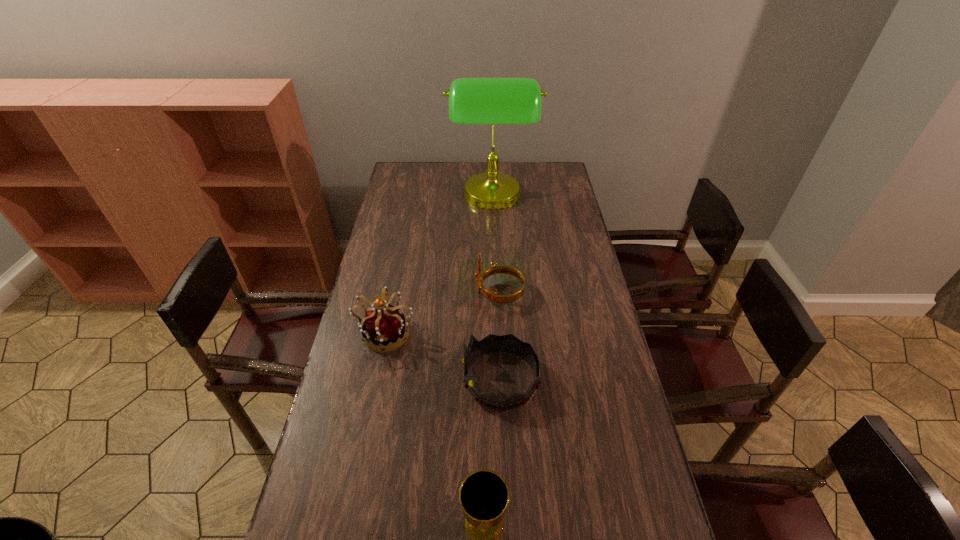
You are a GUI agent. You are given a task and a screenshot of the screen. Output one action in this format:
    pyautogui.click(x=<x>, y=<y>)
    Task: Click on the tallest object
    
    Given the screenshot: What is the action you would take?
    pyautogui.click(x=492, y=101)

Locate an element on the screen. Image resolution: width=960 pixels, height=540 pixels. the farthest object is located at coordinates (492, 101).

The width and height of the screenshot is (960, 540). I want to click on the fourth nearest object, so click(492, 296).

You are a GUI agent. You are given a task and a screenshot of the screen. Output one action in this format:
    pyautogui.click(x=<x>, y=<y>)
    Task: Click on the leftmost tiara
    
    Given the screenshot: What is the action you would take?
    pyautogui.click(x=384, y=326)

Find the location of a particular element. Image resolution: width=960 pixels, height=540 pixels. vacant position located on the desk next to the farthest object is located at coordinates (437, 198).

Locate an element on the screen. Image resolution: width=960 pixels, height=540 pixels. free space located 0.130m on the desk next to the farthest object is located at coordinates (x=422, y=198).

Locate an element on the screen. This screenshot has height=540, width=960. vacant region located on the desk next to the farthest object is located at coordinates (435, 198).

Image resolution: width=960 pixels, height=540 pixels. I want to click on vacant area situated on the front-facing side of the second farthest object, so click(x=459, y=293).

What are the coordinates of `vacant position located 0.140m on the front-facing side of the second farthest object` in the screenshot? It's located at (437, 293).

Identify the location of vacant space situated on the front-facing side of the second farthest object. This screenshot has height=540, width=960. (394, 293).